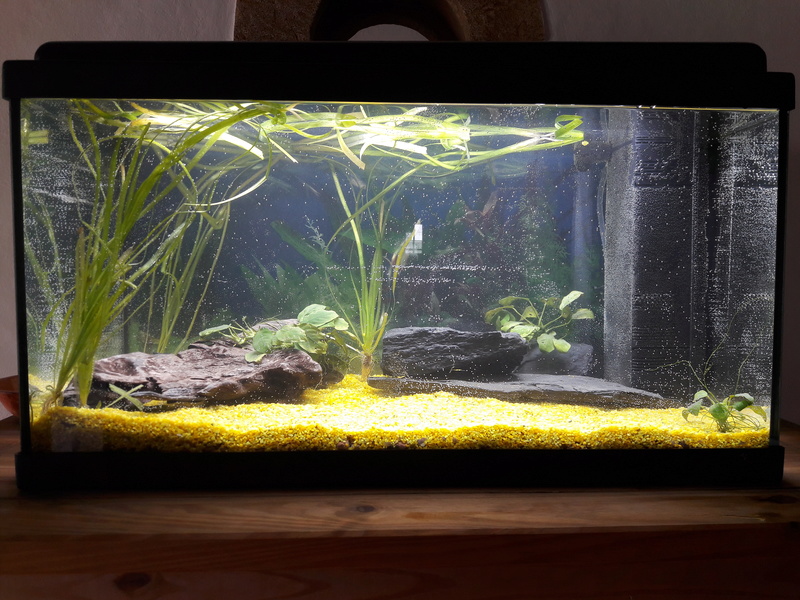
This screenshot has height=600, width=800. Identify the location of lid to aquarium. (412, 56).